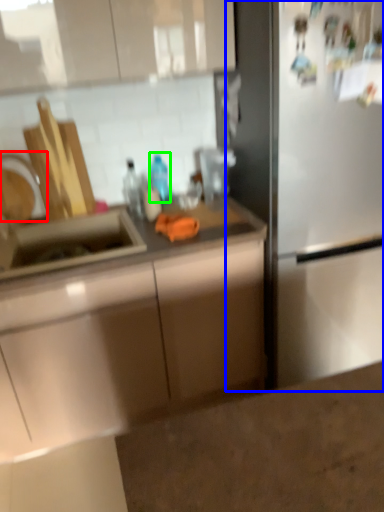
Question: Estimate the real-world distances between objects in this image. Which object is farther from faucet (highlighted by a red box), fridge (highlighted by a blue box) or bottle (highlighted by a green box)?

Choices:
 (A) fridge
 (B) bottle

Answer: (A)